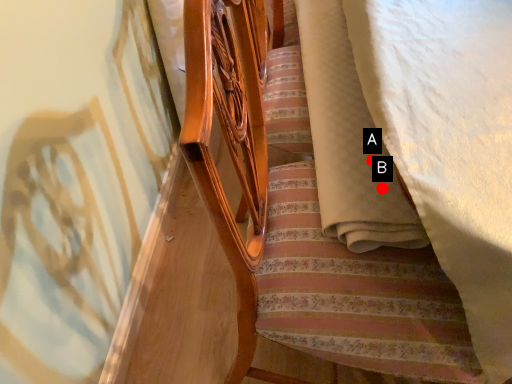
Question: Two points are circled on the image, labeled by A and B beside each circle. Among these points, which one is farthest from the camera?

Choices:
 (A) A is further
 (B) B is further

Answer: (A)